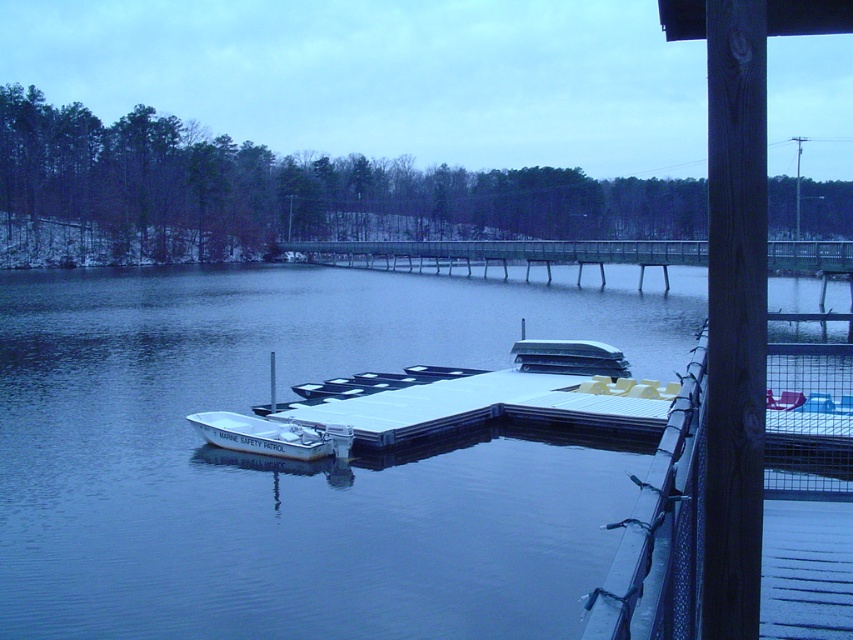
Question: Which object is closer to the camera taking this photo?

Choices:
 (A) white matte boat at lower left
 (B) blue water at center

Answer: (B)

Question: Which point is closer to the camera taking this photo?

Choices:
 (A) (276, 428)
 (B) (544, 608)

Answer: (B)

Question: In this image, where is blue water at center located relative to white matte boat at lower left?

Choices:
 (A) left
 (B) right

Answer: (B)

Question: Which point is closer to the camera taking this photo?

Choices:
 (A) (209, 440)
 (B) (457, 624)

Answer: (B)

Question: Is blue water at center to the right of white matte boat at lower left from the viewer's perspective?

Choices:
 (A) yes
 (B) no

Answer: (A)

Question: Can you confirm if blue water at center is bigger than white matte boat at lower left?

Choices:
 (A) no
 (B) yes

Answer: (B)